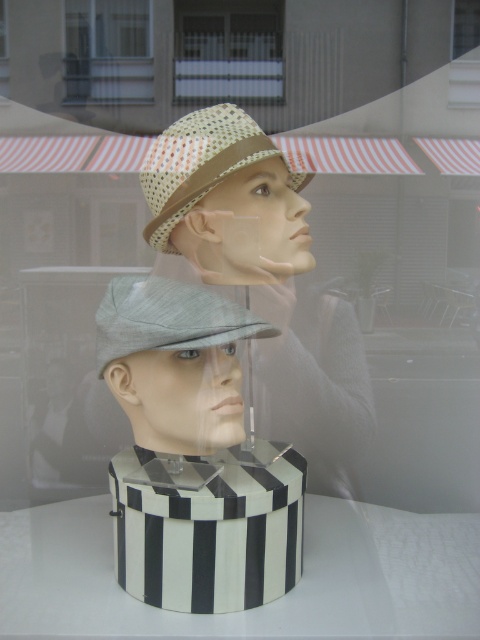
Question: Does black and white striped hat at center appear on the right side of woven straw hat at center?

Choices:
 (A) yes
 (B) no

Answer: (B)

Question: Among these objects, which one is nearest to the camera?

Choices:
 (A) clear glass window at upper center
 (B) black and white striped box at center

Answer: (B)

Question: Observing the image, what is the correct spatial positioning of matte straw hat at center in reference to light beige straw hat at center?

Choices:
 (A) right
 (B) left

Answer: (A)

Question: Which object is closer to the camera taking this photo?

Choices:
 (A) white mesh fence at upper center
 (B) black and white striped hat at center
 (C) light beige straw hat at center
 (D) woven straw hat at center

Answer: (C)

Question: Which point is closer to the camera?

Choices:
 (A) (243, 93)
 (B) (304, 371)

Answer: (A)

Question: Can you confirm if white mesh fence at upper center is bigger than light beige straw hat at center?

Choices:
 (A) no
 (B) yes

Answer: (A)